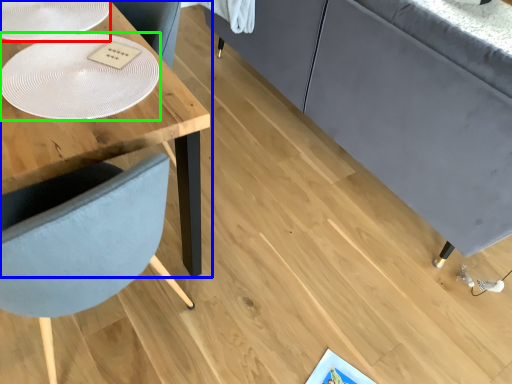
Question: Which is farther away from glass plate (highlighted by a red box)? table (highlighted by a blue box) or glass plate (highlighted by a green box)?

Choices:
 (A) table
 (B) glass plate

Answer: (B)